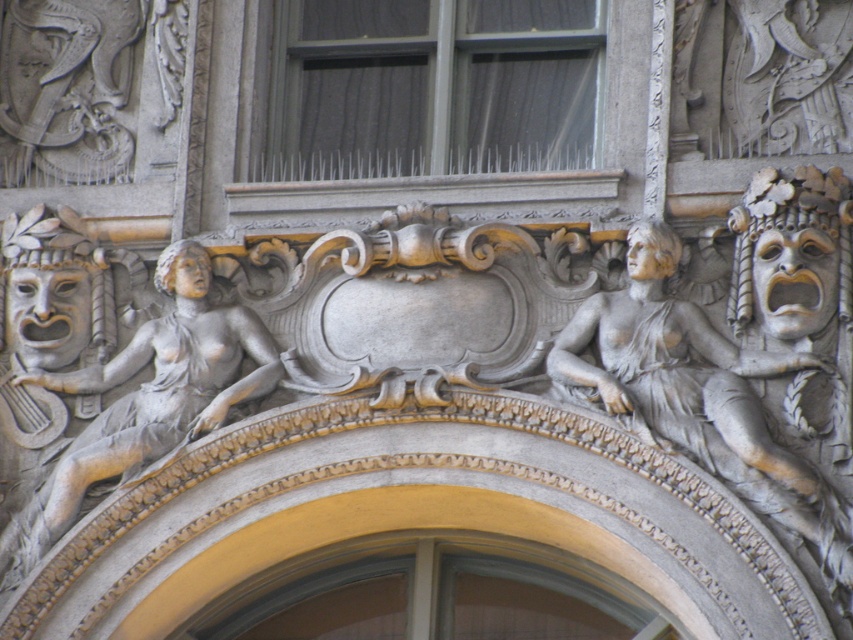
Is gray stone female figure at right below gray stone woman at center?

No.

Does gray stone female figure at right have a smaller size compared to gray stone woman at center?

Yes.

Which is in front, point (608, 323) or point (59, 524)?

Point (608, 323) is more forward.

Where is `gray stone female figure at right`? gray stone female figure at right is located at coordinates (695, 394).